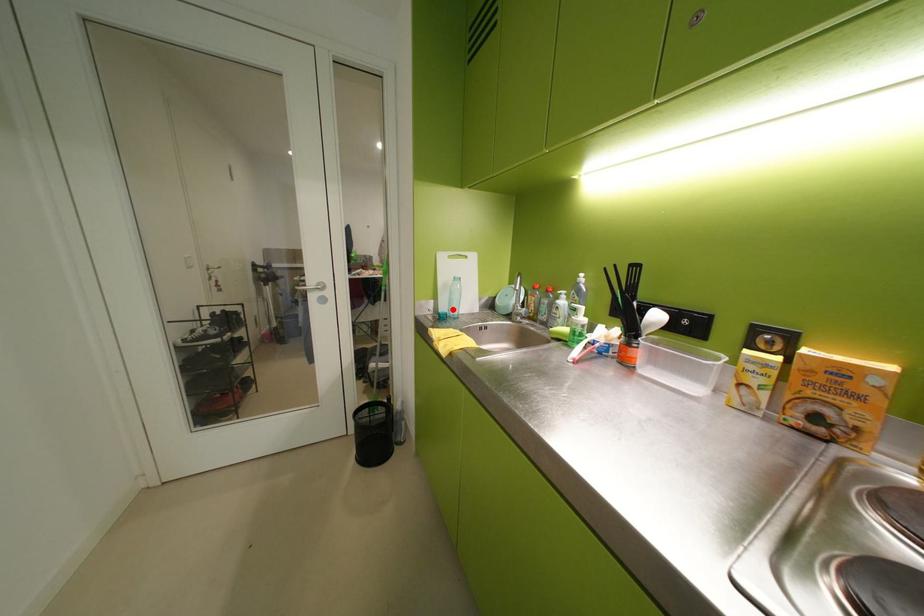
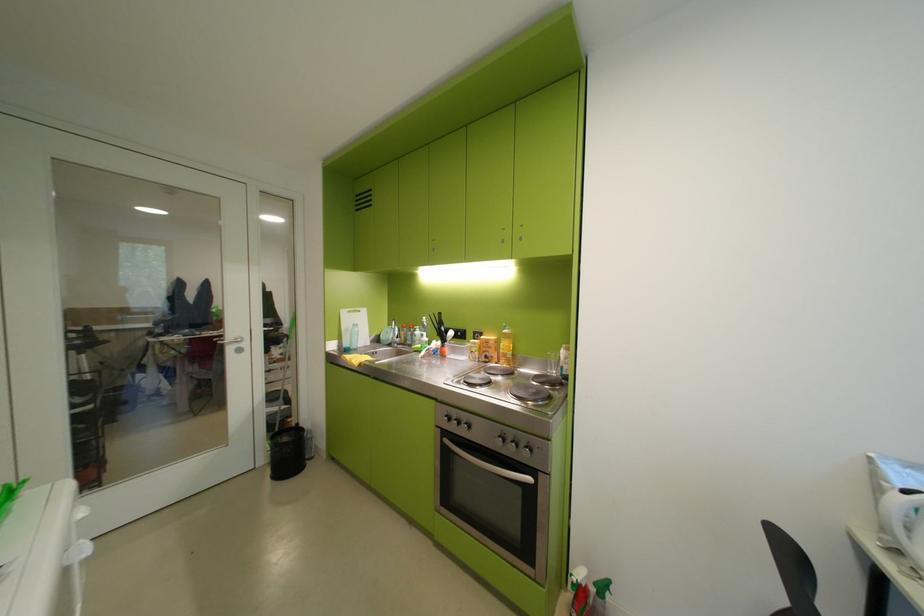
Find the pixel in the second image that matches the highlighted location in the first image.

(357, 345)